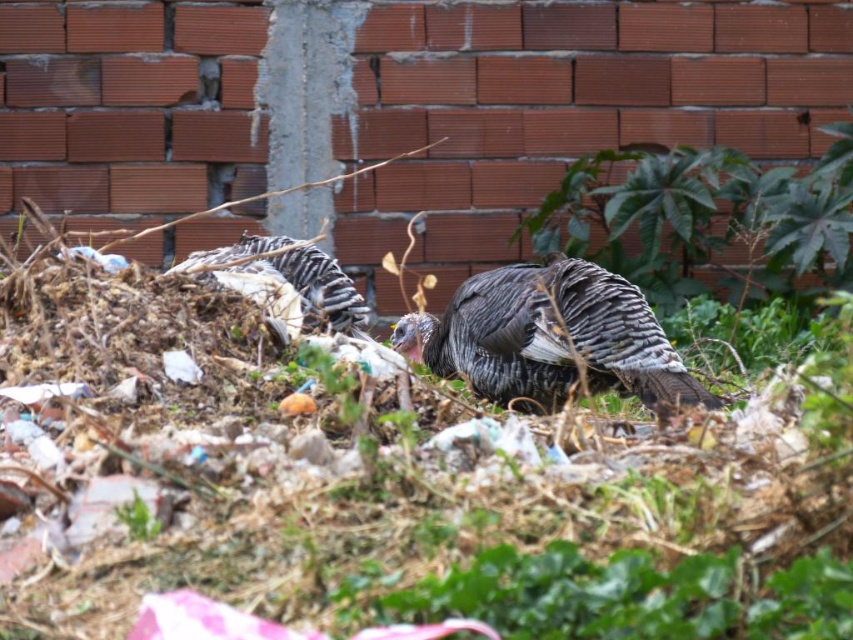
Who is positioned more to the left, gray matte turkey at center or speckled feathered turkey at center?

speckled feathered turkey at center

Can you confirm if gray matte turkey at center is shorter than speckled feathered turkey at center?

Incorrect, gray matte turkey at center's height does not fall short of speckled feathered turkey at center's.

What are the coordinates of `gray matte turkey at center` in the screenshot? It's located at (550, 339).